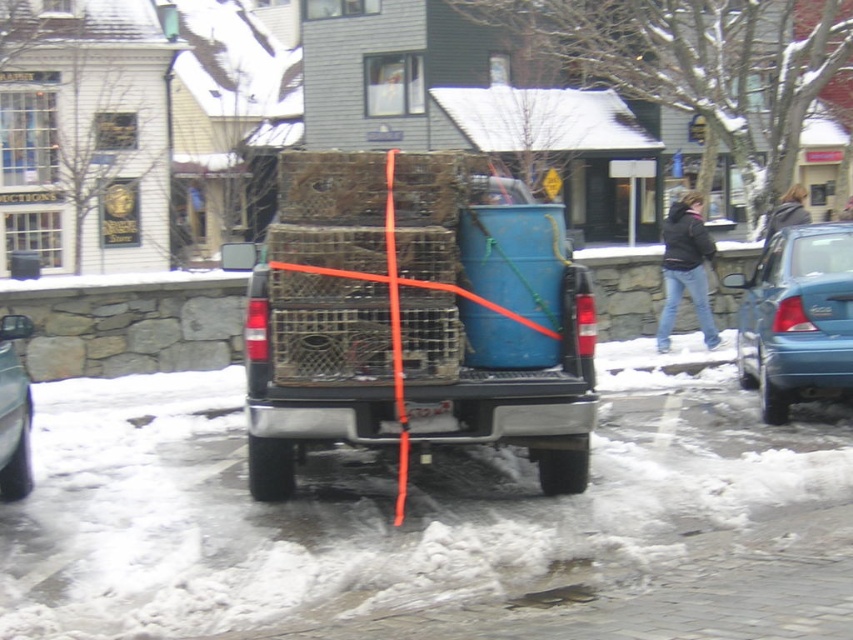
You are a delivery driver who needs to unload a package from your truck. You see the snowy asphalt at lower center and the wooden crates at center. Which surface should you place the package on to avoid it getting wet?

The wooden crates at center are to the right of the snowy asphalt at lower center, so placing the package on the wooden crates at center would keep it drier as the snowy asphalt at lower center is more likely to be wet from snow or slush.

You are standing at the camera position looking at the snowy street scene. There are two points marked in the image, one at coordinates point (x=326, y=513) and another at point (x=323, y=291). Which point is closer to you?

Point (x=323, y=291) is closer to you because the Objects Description states that point (x=326, y=513) is behind point (x=323, y=291).